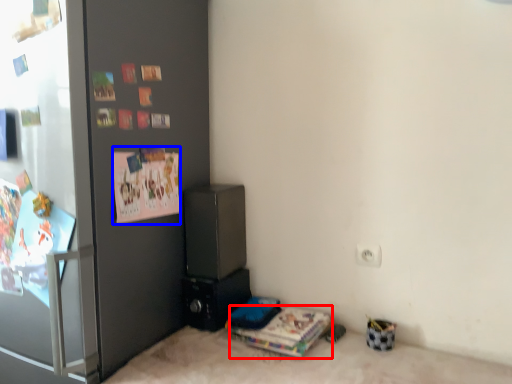
Question: Which object appears farthest to the camera in this image, magazine (highlighted by a red box) or postcard (highlighted by a blue box)?

Choices:
 (A) magazine
 (B) postcard

Answer: (A)